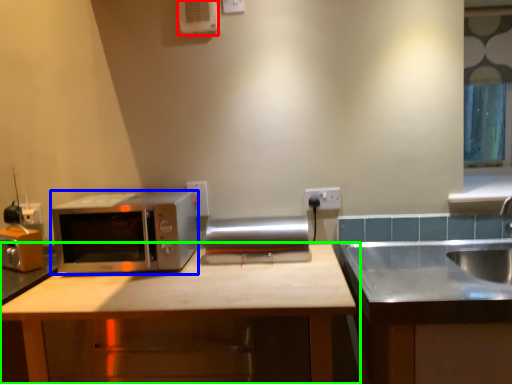
Question: Which is farther away from air conditioner (highlighted by a red box)? microwave oven (highlighted by a blue box) or cabinetry (highlighted by a green box)?

Choices:
 (A) microwave oven
 (B) cabinetry

Answer: (B)